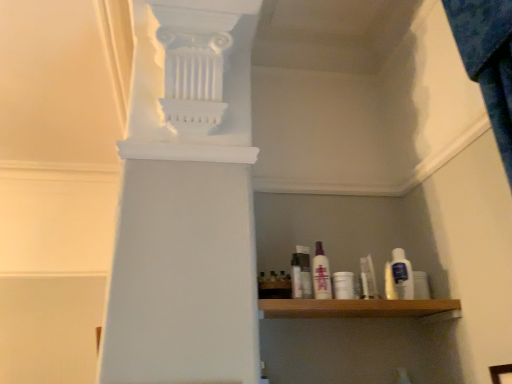
Question: Can you confirm if white plastic bottle at center, which ranks as the 1th toiletry in left-to-right order, is taller than white plastic bottle at right, which appears as the 1th toiletry when viewed from the right?

Choices:
 (A) no
 (B) yes

Answer: (A)

Question: Does white plastic bottle at center, the fifth toiletry from the right, have a larger size compared to white plastic bottle at right, which appears as the 1th toiletry when viewed from the right?

Choices:
 (A) no
 (B) yes

Answer: (A)

Question: Would you consider white plastic bottle at center, the fifth toiletry from the right, to be distant from white plastic bottle at right, which appears as the 1th toiletry when viewed from the right?

Choices:
 (A) no
 (B) yes

Answer: (A)

Question: From the image's perspective, is white plastic bottle at center, which ranks as the 1th toiletry in left-to-right order, on white plastic bottle at right, which is the 5th toiletry from left to right?

Choices:
 (A) yes
 (B) no

Answer: (A)

Question: From a real-world perspective, is white plastic bottle at center, which ranks as the 1th toiletry in left-to-right order, below white plastic bottle at right, which appears as the 1th toiletry when viewed from the right?

Choices:
 (A) no
 (B) yes

Answer: (B)

Question: From a real-world perspective, is white plastic bottle at center, the fifth toiletry from the right, on white plastic bottle at right, which appears as the 1th toiletry when viewed from the right?

Choices:
 (A) yes
 (B) no

Answer: (B)

Question: Is white plastic bottle at center, which ranks as the 1th toiletry in left-to-right order, to the left of translucent purple bottle at center, placed as the 2th toiletry when sorted from left to right, from the viewer's perspective?

Choices:
 (A) no
 (B) yes

Answer: (B)

Question: Is there a large distance between white plastic bottle at center, which ranks as the 1th toiletry in left-to-right order, and translucent purple bottle at center, which is the fourth toiletry in right-to-left order?

Choices:
 (A) no
 (B) yes

Answer: (A)

Question: From a real-world perspective, is white plastic bottle at center, which ranks as the 1th toiletry in left-to-right order, located beneath translucent purple bottle at center, which is the fourth toiletry in right-to-left order?

Choices:
 (A) yes
 (B) no

Answer: (A)

Question: From the image's perspective, is white plastic bottle at center, the fifth toiletry from the right, under translucent purple bottle at center, placed as the 2th toiletry when sorted from left to right?

Choices:
 (A) yes
 (B) no

Answer: (A)

Question: Would you say white plastic bottle at center, which ranks as the 1th toiletry in left-to-right order, contains translucent purple bottle at center, which is the fourth toiletry in right-to-left order?

Choices:
 (A) no
 (B) yes

Answer: (A)

Question: Is white plastic bottle at center, the fifth toiletry from the right, positioned beyond the bounds of translucent purple bottle at center, which is the fourth toiletry in right-to-left order?

Choices:
 (A) no
 (B) yes

Answer: (B)

Question: Is clear plastic bottle at center oriented away from clear plastic bag at center, the second toiletry when ordered from right to left?

Choices:
 (A) no
 (B) yes

Answer: (A)